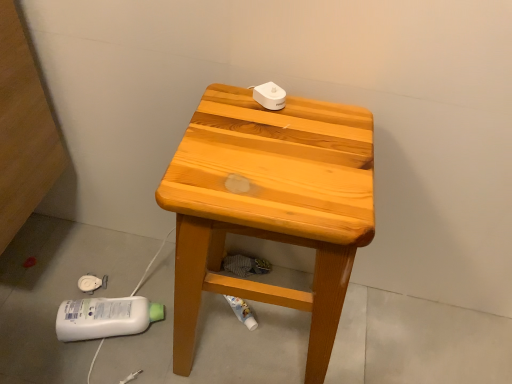
Question: From a real-world perspective, is light brown wooden stool at center positioned over wooden stool at center based on gravity?

Choices:
 (A) yes
 (B) no

Answer: (A)

Question: Is light brown wooden stool at center oriented towards wooden stool at center?

Choices:
 (A) no
 (B) yes

Answer: (A)

Question: Is light brown wooden stool at center in front of wooden stool at center?

Choices:
 (A) no
 (B) yes

Answer: (B)

Question: Is light brown wooden stool at center thinner than wooden stool at center?

Choices:
 (A) yes
 (B) no

Answer: (A)

Question: Can you confirm if light brown wooden stool at center is wider than wooden stool at center?

Choices:
 (A) yes
 (B) no

Answer: (B)

Question: Can you confirm if light brown wooden stool at center is shorter than wooden stool at center?

Choices:
 (A) yes
 (B) no

Answer: (B)

Question: Are wooden stool at center and light brown wooden stool at center beside each other?

Choices:
 (A) no
 (B) yes

Answer: (A)

Question: Considering the relative positions of wooden stool at center and light brown wooden stool at center in the image provided, is wooden stool at center behind light brown wooden stool at center?

Choices:
 (A) yes
 (B) no

Answer: (A)

Question: Is wooden stool at center wider than light brown wooden stool at center?

Choices:
 (A) yes
 (B) no

Answer: (A)

Question: Is wooden stool at center not inside light brown wooden stool at center?

Choices:
 (A) yes
 (B) no

Answer: (A)

Question: Is light brown wooden stool at center surrounded by wooden stool at center?

Choices:
 (A) yes
 (B) no

Answer: (B)

Question: Does wooden stool at center appear on the right side of light brown wooden stool at center?

Choices:
 (A) no
 (B) yes

Answer: (A)

Question: From the image's perspective, is light brown wooden stool at center located above or below wooden stool at center?

Choices:
 (A) below
 (B) above

Answer: (B)